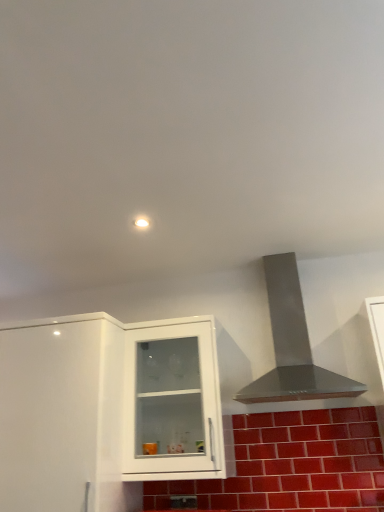
This screenshot has height=512, width=384. What do you see at coordinates (292, 346) in the screenshot?
I see `stainless steel vent at upper right` at bounding box center [292, 346].

Locate an element on the screen. glossy ceramic brick at lower center is located at coordinates (293, 465).

Does white glossy cabinet at left, positioned as the first cabinetry in left-to-right order, lie in front of glossy ceramic brick at lower center?

Yes, white glossy cabinet at left, positioned as the first cabinetry in left-to-right order, is closer to the camera.

Considering the sizes of objects white glossy cabinet at left, which ranks as the 2th cabinetry in right-to-left order, and glossy ceramic brick at lower center in the image provided, who is shorter, white glossy cabinet at left, which ranks as the 2th cabinetry in right-to-left order, or glossy ceramic brick at lower center?

Standing shorter between the two is glossy ceramic brick at lower center.

Consider the image. Is white glossy cabinet at left, which ranks as the 2th cabinetry in right-to-left order, spatially inside glossy ceramic brick at lower center, or outside of it?

white glossy cabinet at left, which ranks as the 2th cabinetry in right-to-left order, is spatially situated outside glossy ceramic brick at lower center.

This screenshot has height=512, width=384. I want to click on brick located underneath the white glossy cabinet at left, which ranks as the 2th cabinetry in right-to-left order (from a real-world perspective), so coord(293,465).

Are white glossy cabinet at left, which ranks as the 2th cabinetry in right-to-left order, and white glossy cabinet at center, positioned as the 1th cabinetry in right-to-left order, far apart?

No, there isn't a large distance between white glossy cabinet at left, which ranks as the 2th cabinetry in right-to-left order, and white glossy cabinet at center, positioned as the 1th cabinetry in right-to-left order.

Who is shorter, white glossy cabinet at left, which ranks as the 2th cabinetry in right-to-left order, or white glossy cabinet at center, positioned as the second cabinetry in left-to-right order?

With less height is white glossy cabinet at center, positioned as the second cabinetry in left-to-right order.

Locate an element on the screen. The image size is (384, 512). cabinetry in front of the white glossy cabinet at center, positioned as the second cabinetry in left-to-right order is located at coordinates (107, 410).

Which point is more forward, (48, 329) or (178, 465)?

Point (178, 465)

In the scene shown: From the image's perspective, between white glossy cabinet at center, positioned as the 1th cabinetry in right-to-left order, and white glossy cabinet at left, which ranks as the 2th cabinetry in right-to-left order, who is located below?

From the image's view, white glossy cabinet at left, which ranks as the 2th cabinetry in right-to-left order, is below.

Considering the relative sizes of white glossy cabinet at center, positioned as the 1th cabinetry in right-to-left order, and white glossy cabinet at left, which ranks as the 2th cabinetry in right-to-left order, in the image provided, is white glossy cabinet at center, positioned as the 1th cabinetry in right-to-left order, shorter than white glossy cabinet at left, which ranks as the 2th cabinetry in right-to-left order,?

Yes, white glossy cabinet at center, positioned as the 1th cabinetry in right-to-left order, is shorter than white glossy cabinet at left, which ranks as the 2th cabinetry in right-to-left order.

Between white glossy cabinet at center, positioned as the second cabinetry in left-to-right order, and white glossy cabinet at left, positioned as the first cabinetry in left-to-right order, which one has larger size?

white glossy cabinet at left, positioned as the first cabinetry in left-to-right order, is bigger.

This screenshot has width=384, height=512. Find the location of `cabinetry behind the white glossy cabinet at left, positioned as the first cabinetry in left-to-right order`. cabinetry behind the white glossy cabinet at left, positioned as the first cabinetry in left-to-right order is located at coordinates (172, 402).

Considering the points (296, 315) and (203, 503), which point is behind, point (296, 315) or point (203, 503)?

The point (296, 315) is behind.

Consider the image. Which object is thinner, stainless steel vent at upper right or glossy ceramic brick at lower center?

Thinner between the two is glossy ceramic brick at lower center.

This screenshot has width=384, height=512. Identify the location of vent above the glossy ceramic brick at lower center (from a real-world perspective). (x=292, y=346).

Is stainless steel vent at upper right far away from glossy ceramic brick at lower center?

No, there isn't a large distance between stainless steel vent at upper right and glossy ceramic brick at lower center.

Between white glossy cabinet at center, positioned as the second cabinetry in left-to-right order, and stainless steel vent at upper right, which one is positioned behind?

white glossy cabinet at center, positioned as the second cabinetry in left-to-right order.

Between point (138, 453) and point (291, 362), which one is positioned behind?

The point (291, 362) is behind.

From a real-world perspective, who is located higher, white glossy cabinet at center, positioned as the 1th cabinetry in right-to-left order, or stainless steel vent at upper right?

stainless steel vent at upper right, from a real-world perspective.

Is white glossy cabinet at center, positioned as the second cabinetry in left-to-right order, not close to stainless steel vent at upper right?

No, white glossy cabinet at center, positioned as the second cabinetry in left-to-right order, is not far from stainless steel vent at upper right.

Are stainless steel vent at upper right and white glossy cabinet at center, positioned as the 1th cabinetry in right-to-left order, making contact?

stainless steel vent at upper right and white glossy cabinet at center, positioned as the 1th cabinetry in right-to-left order, are clearly separated.

Does stainless steel vent at upper right have a greater height compared to white glossy cabinet at center, positioned as the second cabinetry in left-to-right order?

Incorrect, the height of stainless steel vent at upper right is not larger of that of white glossy cabinet at center, positioned as the second cabinetry in left-to-right order.

Based on the photo, could you tell me if stainless steel vent at upper right is facing white glossy cabinet at center, positioned as the 1th cabinetry in right-to-left order?

No.

The width and height of the screenshot is (384, 512). I want to click on the 1st cabinetry to the left of the stainless steel vent at upper right, counting from the anchor's position, so click(172, 402).

Is glossy ceramic brick at lower center turned away from stainless steel vent at upper right?

No, stainless steel vent at upper right is not at the back of glossy ceramic brick at lower center.

Looking at the image, does glossy ceramic brick at lower center seem bigger or smaller compared to stainless steel vent at upper right?

Considering their sizes, glossy ceramic brick at lower center takes up less space than stainless steel vent at upper right.

Considering the sizes of objects glossy ceramic brick at lower center and stainless steel vent at upper right in the image provided, who is taller, glossy ceramic brick at lower center or stainless steel vent at upper right?

With more height is stainless steel vent at upper right.

From a real-world perspective, is glossy ceramic brick at lower center below stainless steel vent at upper right?

Indeed, from a real-world perspective, glossy ceramic brick at lower center is positioned beneath stainless steel vent at upper right.

From the glossy ceramic brick at lower center, count the 2nd cabinetry to the left and point to it. Please provide its 2D coordinates.

[(107, 410)]

Where is `cabinetry in front of the white glossy cabinet at center, positioned as the second cabinetry in left-to-right order`? The width and height of the screenshot is (384, 512). cabinetry in front of the white glossy cabinet at center, positioned as the second cabinetry in left-to-right order is located at coordinates (107, 410).

Based on their spatial positions, is glossy ceramic brick at lower center or white glossy cabinet at center, positioned as the 1th cabinetry in right-to-left order, further from stainless steel vent at upper right?

white glossy cabinet at center, positioned as the 1th cabinetry in right-to-left order, lies further to stainless steel vent at upper right than the other object.

When comparing their distances from white glossy cabinet at center, positioned as the second cabinetry in left-to-right order, does white glossy cabinet at left, positioned as the first cabinetry in left-to-right order, or glossy ceramic brick at lower center seem further?

glossy ceramic brick at lower center is further to white glossy cabinet at center, positioned as the second cabinetry in left-to-right order.

Considering their positions, is white glossy cabinet at center, positioned as the second cabinetry in left-to-right order, positioned further to white glossy cabinet at left, positioned as the first cabinetry in left-to-right order, than glossy ceramic brick at lower center?

Among the two, glossy ceramic brick at lower center is located further to white glossy cabinet at left, positioned as the first cabinetry in left-to-right order.

Considering their positions, is stainless steel vent at upper right positioned closer to glossy ceramic brick at lower center than white glossy cabinet at left, positioned as the first cabinetry in left-to-right order?

The object closer to glossy ceramic brick at lower center is stainless steel vent at upper right.

Which object lies further to the anchor point white glossy cabinet at center, positioned as the 1th cabinetry in right-to-left order, stainless steel vent at upper right or white glossy cabinet at left, positioned as the first cabinetry in left-to-right order?

stainless steel vent at upper right is positioned further to the anchor white glossy cabinet at center, positioned as the 1th cabinetry in right-to-left order.

When comparing their distances from white glossy cabinet at center, positioned as the second cabinetry in left-to-right order, does glossy ceramic brick at lower center or white glossy cabinet at left, which ranks as the 2th cabinetry in right-to-left order, seem closer?

Among the two, white glossy cabinet at left, which ranks as the 2th cabinetry in right-to-left order, is located nearer to white glossy cabinet at center, positioned as the second cabinetry in left-to-right order.

Estimate the real-world distances between objects in this image. Which object is closer to glossy ceramic brick at lower center, white glossy cabinet at center, positioned as the 1th cabinetry in right-to-left order, or stainless steel vent at upper right?

stainless steel vent at upper right lies closer to glossy ceramic brick at lower center than the other object.

When comparing their distances from white glossy cabinet at left, which ranks as the 2th cabinetry in right-to-left order, does glossy ceramic brick at lower center or white glossy cabinet at center, positioned as the second cabinetry in left-to-right order, seem closer?

white glossy cabinet at center, positioned as the second cabinetry in left-to-right order, is closer to white glossy cabinet at left, which ranks as the 2th cabinetry in right-to-left order.

The width and height of the screenshot is (384, 512). I want to click on brick between white glossy cabinet at left, which ranks as the 2th cabinetry in right-to-left order, and stainless steel vent at upper right from left to right, so click(x=293, y=465).

In order to click on cabinetry between white glossy cabinet at left, which ranks as the 2th cabinetry in right-to-left order, and glossy ceramic brick at lower center from left to right in this screenshot , I will do `click(172, 402)`.

This screenshot has height=512, width=384. Identify the location of cabinetry between white glossy cabinet at left, positioned as the first cabinetry in left-to-right order, and stainless steel vent at upper right from left to right. (172, 402).